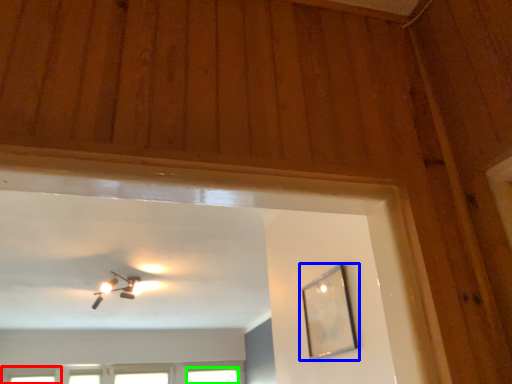
Question: Which object is the farthest from window (highlighted by a red box)? Choose among these: picture frame (highlighted by a blue box) or window (highlighted by a green box).

Choices:
 (A) picture frame
 (B) window

Answer: (A)